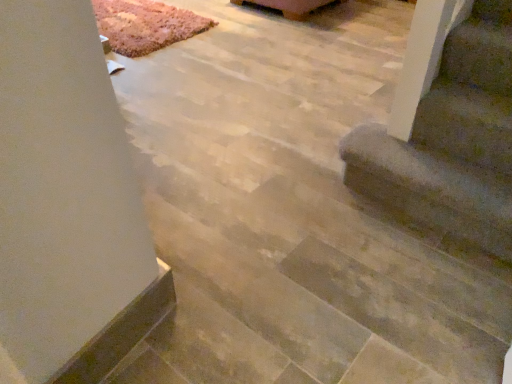
The image size is (512, 384). In order to click on wooden coffee table at upper center in this screenshot , I will do `click(289, 6)`.

Locate an element on the screen. Image resolution: width=512 pixels, height=384 pixels. rug carpet at upper left is located at coordinates (145, 25).

Find the location of a particular element. brown fuzzy carpet at lower right is located at coordinates (452, 142).

Is wooden coffee table at upper center taller or shorter than brown fuzzy carpet at lower right?

wooden coffee table at upper center is shorter than brown fuzzy carpet at lower right.

Is wooden coffee table at upper center turned away from brown fuzzy carpet at lower right?

wooden coffee table at upper center does not have its back to brown fuzzy carpet at lower right.

From a real-world perspective, is wooden coffee table at upper center on top of brown fuzzy carpet at lower right?

Actually, wooden coffee table at upper center is physically below brown fuzzy carpet at lower right in the real world.

In order to click on furniture on the left of brown fuzzy carpet at lower right in this screenshot , I will do `click(289, 6)`.

From the picture: From the image's perspective, which is above, wooden coffee table at upper center or rug carpet at upper left?

From the image's view, wooden coffee table at upper center is above.

Considering the positions of point (332, 1) and point (194, 19), is point (332, 1) closer or farther from the camera than point (194, 19)?

Point (332, 1).

Is wooden coffee table at upper center not near rug carpet at upper left?

They are positioned close to each other.

Are rug carpet at upper left and wooden coffee table at upper center located far from each other?

rug carpet at upper left is near wooden coffee table at upper center, not far away.

Can you confirm if rug carpet at upper left is wider than wooden coffee table at upper center?

Indeed, rug carpet at upper left has a greater width compared to wooden coffee table at upper center.

Could you tell me if rug carpet at upper left is facing wooden coffee table at upper center?

Yes, rug carpet at upper left is turned towards wooden coffee table at upper center.

From their relative heights in the image, would you say rug carpet at upper left is taller or shorter than wooden coffee table at upper center?

Considering their sizes, rug carpet at upper left has less height than wooden coffee table at upper center.

From a real-world perspective, which is physically below, rug carpet at upper left or brown fuzzy carpet at lower right?

rug carpet at upper left.

Consider the image. Is rug carpet at upper left turned away from brown fuzzy carpet at lower right?

No, brown fuzzy carpet at lower right is not at the back of rug carpet at upper left.

Between point (172, 39) and point (509, 234), which one is positioned in front?

Positioned in front is point (509, 234).

Who is more distant, rug carpet at upper left or brown fuzzy carpet at lower right?

Positioned behind is rug carpet at upper left.

Considering the relative sizes of brown fuzzy carpet at lower right and rug carpet at upper left in the image provided, is brown fuzzy carpet at lower right shorter than rug carpet at upper left?

No.

From the picture: Which object is closer to the camera, brown fuzzy carpet at lower right or rug carpet at upper left?

brown fuzzy carpet at lower right is in front.

Considering the positions of points (357, 185) and (109, 23), is point (357, 185) closer to camera compared to point (109, 23)?

Yes, it is.

Which of these two, brown fuzzy carpet at lower right or rug carpet at upper left, is wider?

rug carpet at upper left is wider.

From a real-world perspective, who is located lower, brown fuzzy carpet at lower right or wooden coffee table at upper center?

wooden coffee table at upper center.

Between brown fuzzy carpet at lower right and wooden coffee table at upper center, which one has less height?

wooden coffee table at upper center.

Which is closer to the camera, (509, 156) or (286, 1)?

Point (509, 156) appears to be closer to the viewer than point (286, 1).

Where is `stairs that is above the wooden coffee table at upper center (from a real-world perspective)`? This screenshot has height=384, width=512. stairs that is above the wooden coffee table at upper center (from a real-world perspective) is located at coordinates (452, 142).

Identify the location of mat beneath the wooden coffee table at upper center (from a real-world perspective). The image size is (512, 384). (145, 25).

Which object lies nearer to the anchor point rug carpet at upper left, wooden coffee table at upper center or brown fuzzy carpet at lower right?

Based on the image, wooden coffee table at upper center appears to be nearer to rug carpet at upper left.

When comparing their distances from brown fuzzy carpet at lower right, does rug carpet at upper left or wooden coffee table at upper center seem closer?

rug carpet at upper left is positioned closer to the anchor brown fuzzy carpet at lower right.

Which object lies nearer to the anchor point rug carpet at upper left, brown fuzzy carpet at lower right or wooden coffee table at upper center?

wooden coffee table at upper center is closer to rug carpet at upper left.

Looking at the image, which one is located further to wooden coffee table at upper center, brown fuzzy carpet at lower right or rug carpet at upper left?

brown fuzzy carpet at lower right is further to wooden coffee table at upper center.

Estimate the real-world distances between objects in this image. Which object is closer to brown fuzzy carpet at lower right, wooden coffee table at upper center or rug carpet at upper left?

rug carpet at upper left is positioned closer to the anchor brown fuzzy carpet at lower right.

Based on their spatial positions, is rug carpet at upper left or brown fuzzy carpet at lower right closer to wooden coffee table at upper center?

Based on the image, rug carpet at upper left appears to be nearer to wooden coffee table at upper center.

The image size is (512, 384). What are the coordinates of `mat between brown fuzzy carpet at lower right and wooden coffee table at upper center from front to back` in the screenshot? It's located at (145, 25).